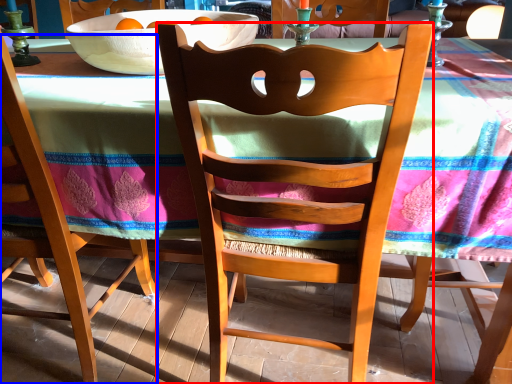
Question: Which point is further to the camera, chair (highlighted by a red box) or chair (highlighted by a blue box)?

Choices:
 (A) chair
 (B) chair

Answer: (B)